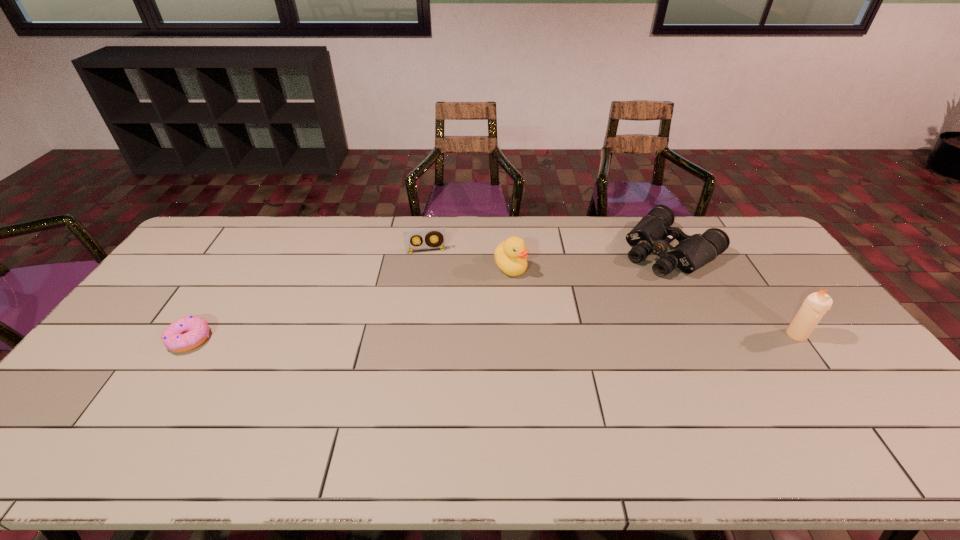
Where is `the third closest object to the third object from left to right`? The width and height of the screenshot is (960, 540). the third closest object to the third object from left to right is located at coordinates (815, 305).

Locate which object ranks second in proximity to the tallest object. Please provide its 2D coordinates. Your answer should be formatted as a tuple, i.e. [(x, y)], where the tuple contains the x and y coordinates of a point satisfying the conditions above.

[(510, 255)]

At what (x,y) coordinates should I click in order to perform the action: click on free space in the image that satisfies the following two spatial constraints: 1. on the front side of the second tallest object; 2. on the left side of the tallest object. Please return your answer as a coordinate pair (x, y). This screenshot has width=960, height=540. Looking at the image, I should click on (516, 335).

Where is `free spot that satisfies the following two spatial constraints: 1. on the front side of the binoculars; 2. on the right side of the candle`? The width and height of the screenshot is (960, 540). free spot that satisfies the following two spatial constraints: 1. on the front side of the binoculars; 2. on the right side of the candle is located at coordinates click(716, 335).

Image resolution: width=960 pixels, height=540 pixels. Find the location of `free spot that satisfies the following two spatial constraints: 1. on the front side of the rightmost object; 2. on the right side of the second tallest object`. free spot that satisfies the following two spatial constraints: 1. on the front side of the rightmost object; 2. on the right side of the second tallest object is located at coordinates (516, 335).